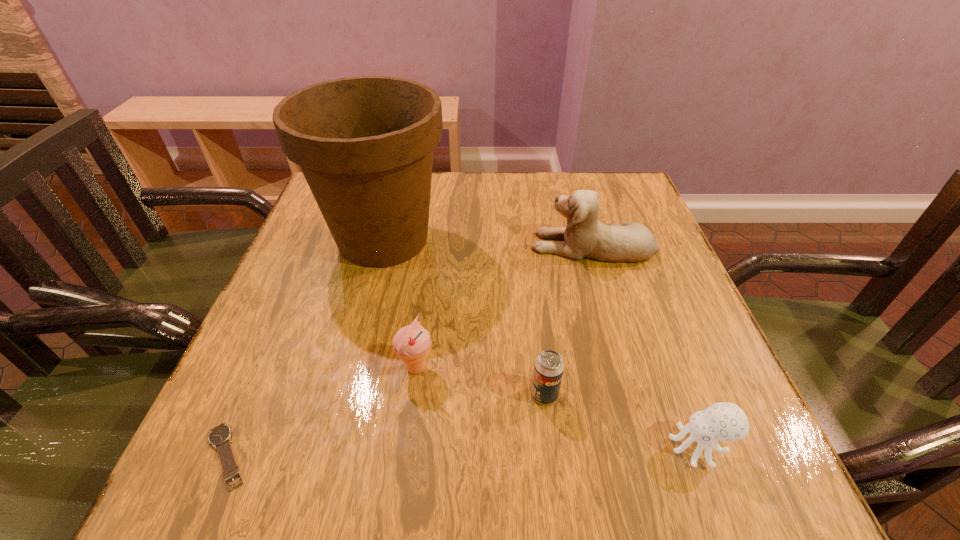
Locate an element on the screen. Image resolution: width=960 pixels, height=540 pixels. watch located at the left edge is located at coordinates (220, 436).

You are a GUI agent. You are given a task and a screenshot of the screen. Output one action in this format:
    pyautogui.click(x=<x>, y=<y>)
    Task: Click on the puppy that is at the right edge
    The height and width of the screenshot is (540, 960).
    Given the screenshot: What is the action you would take?
    pyautogui.click(x=585, y=236)

At what (x,y) coordinates should I click in order to perform the action: click on octopus present at the right edge. Please return your answer as a coordinate pair (x, y). Looking at the image, I should click on (723, 421).

Find the location of `object at the far left corner`. object at the far left corner is located at coordinates (365, 145).

The height and width of the screenshot is (540, 960). I want to click on object that is at the near left corner, so click(x=220, y=436).

Find the location of a particular element. The width and height of the screenshot is (960, 540). object at the near right corner is located at coordinates (723, 421).

Locate an element on the screen. The width and height of the screenshot is (960, 540). free location at the far edge of the desktop is located at coordinates tap(543, 192).

This screenshot has height=540, width=960. I want to click on free space at the near edge of the desktop, so click(528, 449).

At what (x,y) coordinates should I click in order to perform the action: click on vacant space at the right edge of the desktop. Please return your answer as a coordinate pair (x, y). Image resolution: width=960 pixels, height=540 pixels. Looking at the image, I should click on (659, 237).

Locate an element on the screen. This screenshot has height=540, width=960. free space at the far right corner of the desktop is located at coordinates (601, 187).